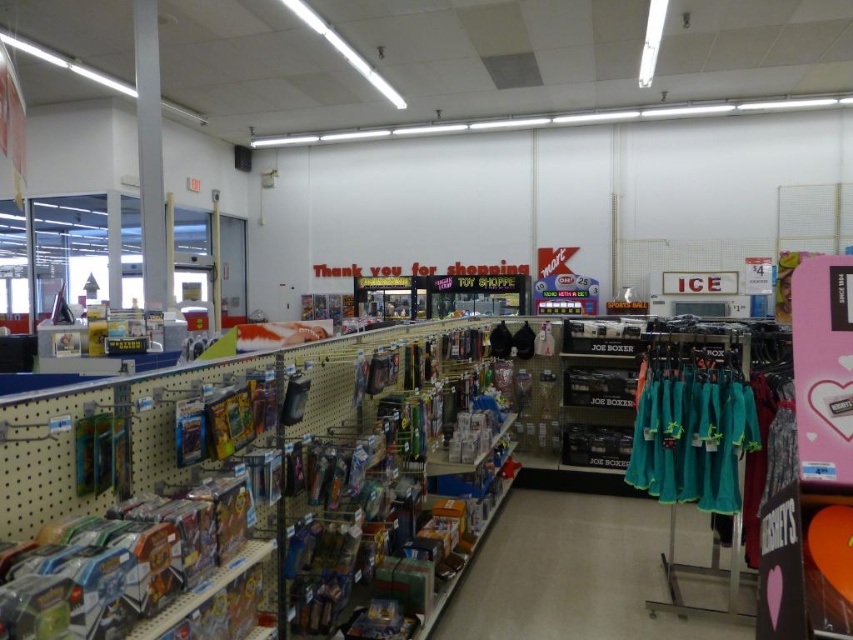
From the picture: You are a customer in the store and want to reach the teal fabric clothing at center. The metallic pole at center is blocking your path. Can you move the pole to access the clothing?

The teal fabric clothing at center is located below the metallic pole at center, so you can simply reach down to access the clothing without needing to move the pole.

You are a store employee who needs to hang a new sign between the teal fabric clothing at center and the metallic pole at center. The sign requires a minimum of 2 meters of space to be placed safely. Is there enough space between them?

The teal fabric clothing at center is 3.18 meters from metallic pole at center, so yes, there is enough space to place the sign between them since the distance is greater than the required 2 meters.

You are a customer in the store and want to grab both the teal fabric clothing at center and the metallic pole at center. Which one should you pick up first if you want to start from the left side of the store?

You should pick up the metallic pole at center first because it is to the left of the teal fabric clothing at center, so starting from the left side of the store, you would encounter the metallic pole at center before the teal fabric clothing at center.